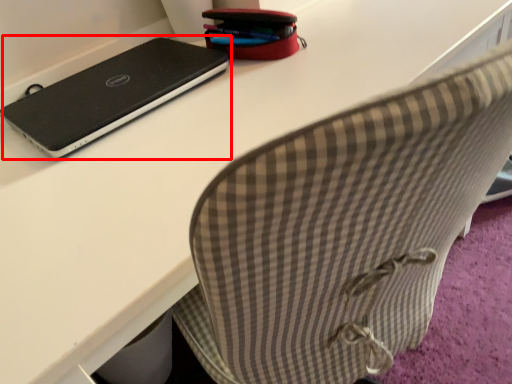
Question: From the image, what is the correct spatial relationship of laptop (annotated by the red box) in relation to pencil case?

Choices:
 (A) right
 (B) left

Answer: (B)